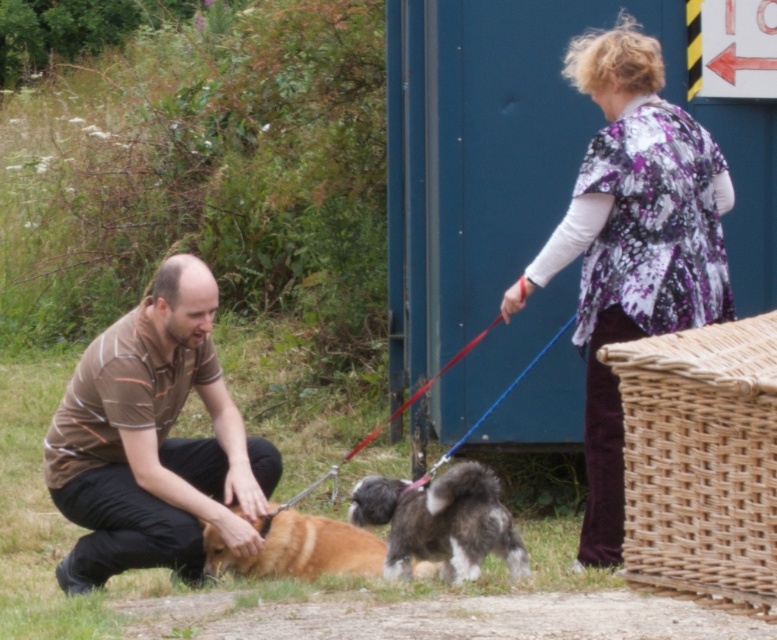
Does point (702, 246) lie behind point (319, 570)?

That is False.

Looking at this image, does floral-patterned fabric at upper right have a larger size compared to golden fur dog at center?

Correct, floral-patterned fabric at upper right is larger in size than golden fur dog at center.

Between point (692, 198) and point (312, 552), which one is positioned behind?

The point (312, 552) is more distant.

Where is `floral-patterned fabric at upper right`? This screenshot has width=777, height=640. floral-patterned fabric at upper right is located at coordinates (632, 243).

Does brown striped shirt at lower left have a lesser width compared to golden fur dog at center?

No.

This screenshot has height=640, width=777. Describe the element at coordinates (152, 440) in the screenshot. I see `brown striped shirt at lower left` at that location.

Is point (127, 420) more distant than point (262, 547)?

No.

The height and width of the screenshot is (640, 777). What are the coordinates of `brown striped shirt at lower left` in the screenshot? It's located at (152, 440).

Is floral-patterned fabric at upper right further to camera compared to brown striped shirt at lower left?

No, it is in front of brown striped shirt at lower left.

Find the location of a particular element. The width and height of the screenshot is (777, 640). floral-patterned fabric at upper right is located at coordinates (632, 243).

Who is more distant from viewer, (509, 288) or (213, 278)?

Positioned behind is point (509, 288).

Locate an element on the screen. This screenshot has width=777, height=640. floral-patterned fabric at upper right is located at coordinates (632, 243).